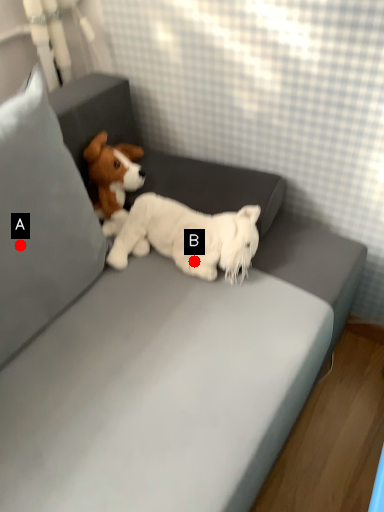
Question: Two points are circled on the image, labeled by A and B beside each circle. Among these points, which one is nearest to the camera?

Choices:
 (A) A is closer
 (B) B is closer

Answer: (A)